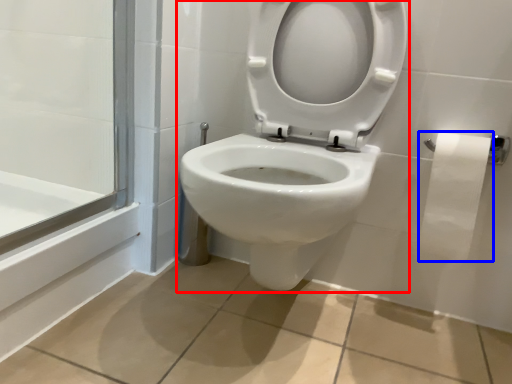
Question: Among these objects, which one is nearest to the camera, toilet (highlighted by a red box) or toilet paper (highlighted by a blue box)?

Choices:
 (A) toilet
 (B) toilet paper

Answer: (A)